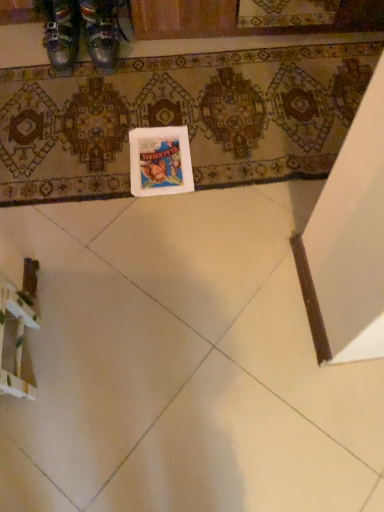
Identify the location of free space above white glossy tile at lower left (from a real-world perspective). (189, 382).